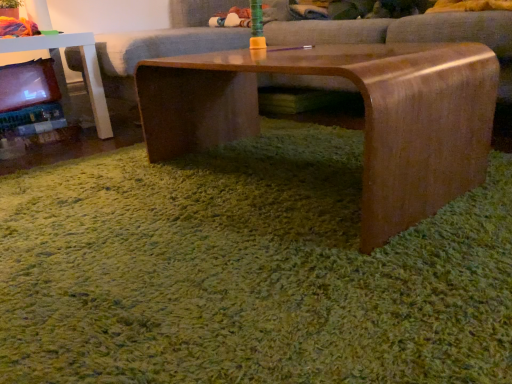
Question: Is green shaggy carpet at center in front of or behind shiny brown wood coffee table at center in the image?

Choices:
 (A) behind
 (B) front

Answer: (B)

Question: In terms of width, does green shaggy carpet at center look wider or thinner when compared to shiny brown wood coffee table at center?

Choices:
 (A) wide
 (B) thin

Answer: (A)

Question: Which of these objects is positioned farthest from the shiny brown wood coffee table at center?

Choices:
 (A) matte plastic toy at left
 (B) green shaggy carpet at center
 (C) matte brown couch at center

Answer: (A)

Question: Estimate the real-world distances between objects in this image. Which object is closer to the shiny brown wood coffee table at center?

Choices:
 (A) green shaggy carpet at center
 (B) matte plastic toy at left
 (C) matte brown couch at center

Answer: (A)